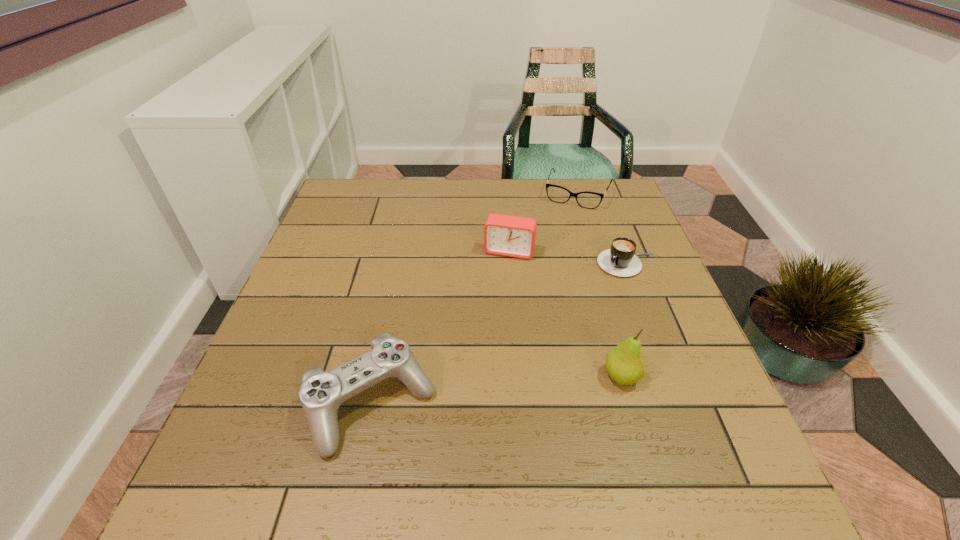
The height and width of the screenshot is (540, 960). I want to click on vacant space on the desktop that is between the third tallest object and the pear and is positioned on the front-facing side of the fourth shortest object, so click(x=468, y=393).

The image size is (960, 540). What are the coordinates of `free space on the desktop that is between the third tallest object and the tallest object and is positioned on the front-facing side of the spectacles` in the screenshot? It's located at (496, 390).

Locate an element on the screen. Image resolution: width=960 pixels, height=540 pixels. vacant spot on the desktop that is between the third shortest object and the pear and is positioned with the handle on the side of the cappuccino is located at coordinates (512, 388).